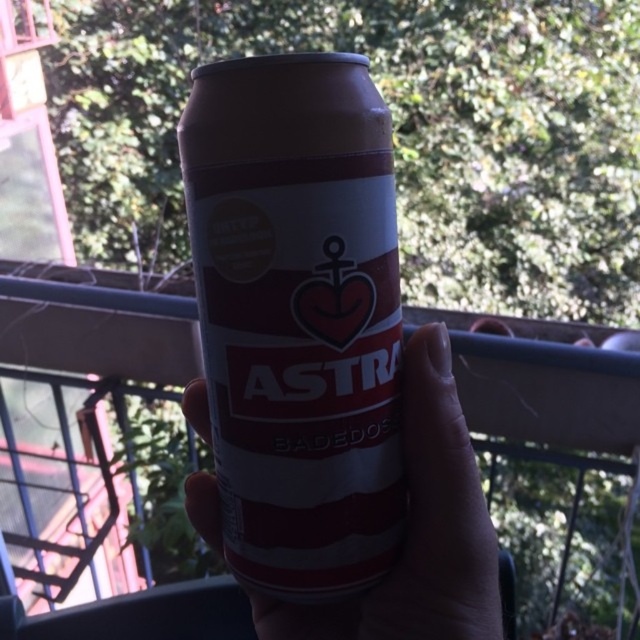
Question: Can you confirm if matte red can at center is positioned below matte plastic can at center?

Choices:
 (A) yes
 (B) no

Answer: (B)

Question: Which point is closer to the camera?

Choices:
 (A) matte plastic can at center
 (B) matte red can at center

Answer: (B)

Question: Which point is farther to the camera?

Choices:
 (A) matte plastic can at center
 (B) matte red can at center

Answer: (A)

Question: Where is matte red can at center located in relation to matte plastic can at center in the image?

Choices:
 (A) below
 (B) above

Answer: (B)

Question: Where is matte red can at center located in relation to matte plastic can at center in the image?

Choices:
 (A) left
 (B) right

Answer: (A)

Question: Which point is farther to the camera?

Choices:
 (A) matte red can at center
 (B) matte plastic can at center

Answer: (B)